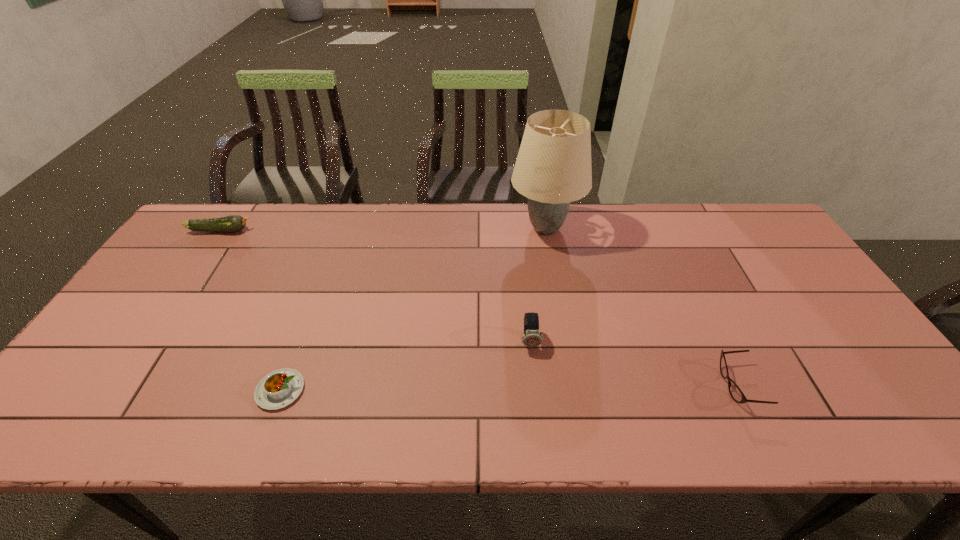
This screenshot has height=540, width=960. Identify the location of free space located on the front-facing side of the rightmost object. (558, 386).

Locate an element on the screen. The width and height of the screenshot is (960, 540). free space located on the front-facing side of the rightmost object is located at coordinates (623, 386).

The height and width of the screenshot is (540, 960). Identify the location of vacant position located 0.270m on the front-facing side of the rightmost object. (606, 386).

Locate an element on the screen. The image size is (960, 540). free location located 0.360m on the right of the pudding is located at coordinates (461, 390).

Image resolution: width=960 pixels, height=540 pixels. I want to click on lampshade that is at the far edge, so pos(553,168).

Where is `zucchini present at the far edge`? Image resolution: width=960 pixels, height=540 pixels. zucchini present at the far edge is located at coordinates (233, 223).

Image resolution: width=960 pixels, height=540 pixels. Identify the location of spectacles that is at the near edge. [x=737, y=395].

Identify the location of pudding that is at the near edge. (276, 390).

This screenshot has width=960, height=540. What are the coordinates of `object that is at the left edge` in the screenshot? It's located at (233, 223).

In order to click on object that is at the far left corner in this screenshot , I will do (x=233, y=223).